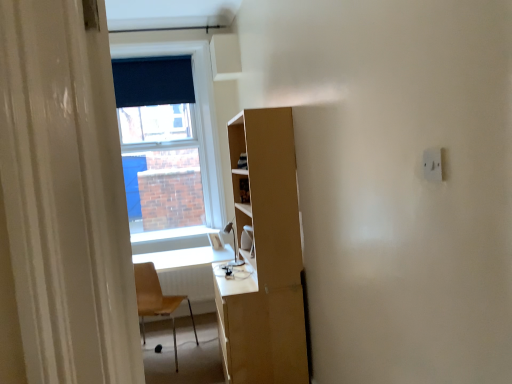
The height and width of the screenshot is (384, 512). I want to click on dark blue fabric at upper center, so click(x=154, y=98).

In order to face light brown plastic chair at lower left, should I rotate leftwards or rightwards?

A 13.588 degree turn to the left will do.

Where is `light brown plastic chair at lower left`? This screenshot has height=384, width=512. light brown plastic chair at lower left is located at coordinates (156, 301).

What do you see at coordinates (184, 258) in the screenshot? I see `white glossy computer desk at center` at bounding box center [184, 258].

The width and height of the screenshot is (512, 384). What do you see at coordinates (432, 164) in the screenshot?
I see `white plastic electric outlet at upper right` at bounding box center [432, 164].

What do you see at coordinates (170, 239) in the screenshot? The image size is (512, 384). I see `white glossy window sill at center` at bounding box center [170, 239].

Identify the location of dark blue fabric at upper center. (154, 98).

Can you confirm if white plastic electric outlet at upper right is taller than white glossy window sill at center?

Correct, white plastic electric outlet at upper right is much taller as white glossy window sill at center.

Who is bigger, white plastic electric outlet at upper right or white glossy window sill at center?

white glossy window sill at center.

Is the surface of white plastic electric outlet at upper right in direct contact with white glossy window sill at center?

No, white plastic electric outlet at upper right is not making contact with white glossy window sill at center.

Is point (432, 179) farther from camera compared to point (147, 236)?

No, (432, 179) is in front of (147, 236).

Can you tell me how much white plastic electric outlet at upper right and white glossy computer desk at center differ in facing direction?

There is a 90-degree angle between the facing directions of white plastic electric outlet at upper right and white glossy computer desk at center.

Which is more to the right, white plastic electric outlet at upper right or white glossy computer desk at center?

white plastic electric outlet at upper right.

Is white plastic electric outlet at upper right wider than white glossy computer desk at center?

No.

Considering the positions of point (198, 244) and point (435, 160), is point (198, 244) closer or farther from the camera than point (435, 160)?

Point (198, 244) is farther from the camera than point (435, 160).

What's the angular difference between white glossy window sill at center and white plastic electric outlet at upper right's facing directions?

The facing directions of white glossy window sill at center and white plastic electric outlet at upper right are 89.6 degrees apart.

Which object is positioned more to the left, white glossy window sill at center or white plastic electric outlet at upper right?

white glossy window sill at center is more to the left.

Which object is further away from the camera, white glossy window sill at center or white plastic electric outlet at upper right?

white glossy window sill at center is more distant.

Are white plastic electric outlet at upper right and dark blue fabric at upper center beside each other?

No, white plastic electric outlet at upper right is not with dark blue fabric at upper center.

From a real-world perspective, which object rests below the other?

white plastic electric outlet at upper right, from a real-world perspective.

Considering the positions of point (431, 171) and point (182, 63), is point (431, 171) closer or farther from the camera than point (182, 63)?

Clearly, point (431, 171) is closer to the camera than point (182, 63).

Is white plastic electric outlet at upper right smaller than dark blue fabric at upper center?

Yes.

Which is behind, light brown plastic chair at lower left or dark blue fabric at upper center?

dark blue fabric at upper center is behind.

From a real-world perspective, is light brown plastic chair at lower left positioned above or below dark blue fabric at upper center?

light brown plastic chair at lower left is situated lower than dark blue fabric at upper center in the real world.

Is light brown plastic chair at lower left shorter than dark blue fabric at upper center?

No.

Can we say light brown plastic chair at lower left lies outside dark blue fabric at upper center?

Yes, light brown plastic chair at lower left is outside of dark blue fabric at upper center.

Can you confirm if white glossy computer desk at center is positioned to the right of light brown plastic chair at lower left?

Yes.

Is white glossy computer desk at center positioned far away from light brown plastic chair at lower left?

Actually, white glossy computer desk at center and light brown plastic chair at lower left are a little close together.

From a real-world perspective, is white glossy computer desk at center positioned above or below light brown plastic chair at lower left?

white glossy computer desk at center is below light brown plastic chair at lower left.

Is white glossy window sill at center facing towards white glossy computer desk at center?

No, white glossy window sill at center is not aimed at white glossy computer desk at center.

Considering the sizes of objects white glossy window sill at center and white glossy computer desk at center in the image provided, who is bigger, white glossy window sill at center or white glossy computer desk at center?

white glossy computer desk at center is bigger.

Consider the image. Is white glossy window sill at center wider than white glossy computer desk at center?

No, white glossy window sill at center is not wider than white glossy computer desk at center.

From a real-world perspective, is white glossy window sill at center physically above white glossy computer desk at center?

Yes, from a real-world perspective, white glossy window sill at center is over white glossy computer desk at center

There is a white glossy window sill at center. Identify the location of electric outlet above it (from a real-world perspective). (432, 164).

This screenshot has width=512, height=384. I want to click on computer desk on the left of white plastic electric outlet at upper right, so click(184, 258).

Which object lies further to the anchor point light brown plastic chair at lower left, dark blue fabric at upper center or white plastic electric outlet at upper right?

The object further to light brown plastic chair at lower left is white plastic electric outlet at upper right.

Considering their positions, is white plastic electric outlet at upper right positioned closer to white glossy window sill at center than dark blue fabric at upper center?

dark blue fabric at upper center.

Which object lies further to the anchor point light brown plastic chair at lower left, white plastic electric outlet at upper right or white glossy window sill at center?

white plastic electric outlet at upper right lies further to light brown plastic chair at lower left than the other object.

Looking at this image, looking at the image, which one is located closer to dark blue fabric at upper center, white glossy computer desk at center or white glossy window sill at center?

white glossy window sill at center is closer to dark blue fabric at upper center.

From the image, which object appears to be nearer to white glossy window sill at center, white plastic electric outlet at upper right or white glossy computer desk at center?

Among the two, white glossy computer desk at center is located nearer to white glossy window sill at center.

In the scene shown: Looking at the image, which one is located further to white plastic electric outlet at upper right, dark blue fabric at upper center or light brown plastic chair at lower left?

dark blue fabric at upper center is positioned further to the anchor white plastic electric outlet at upper right.

Looking at the image, which one is located further to white plastic electric outlet at upper right, white glossy computer desk at center or dark blue fabric at upper center?

The object further to white plastic electric outlet at upper right is dark blue fabric at upper center.

Estimate the real-world distances between objects in this image. Which object is further from white plastic electric outlet at upper right, light brown plastic chair at lower left or white glossy computer desk at center?

The object further to white plastic electric outlet at upper right is white glossy computer desk at center.

The width and height of the screenshot is (512, 384). What are the coordinates of `window sill that lies between dark blue fabric at upper center and light brown plastic chair at lower left from top to bottom` in the screenshot? It's located at (170, 239).

The height and width of the screenshot is (384, 512). In order to click on chair that lies between dark blue fabric at upper center and white glossy computer desk at center from top to bottom in this screenshot , I will do `click(156, 301)`.

Find the location of a particular element. The width and height of the screenshot is (512, 384). chair between white plastic electric outlet at upper right and white glossy computer desk at center from front to back is located at coordinates (156, 301).

The image size is (512, 384). Identify the location of chair between white plastic electric outlet at upper right and white glossy window sill at center from front to back. tap(156, 301).